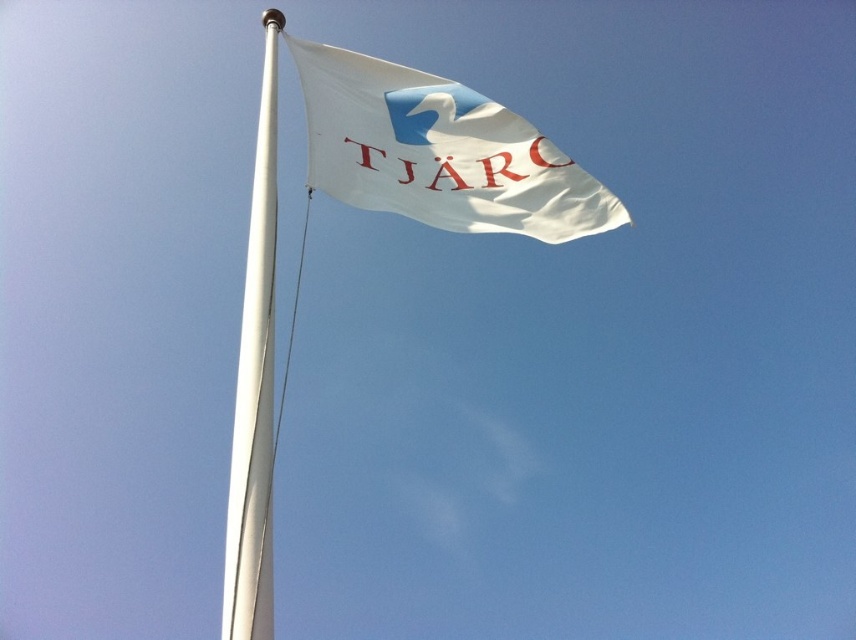
Is white fabric flag at upper center smaller than white metallic pole at upper left?

Yes, white fabric flag at upper center is smaller than white metallic pole at upper left.

Image resolution: width=856 pixels, height=640 pixels. Find the location of `white fabric flag at upper center`. white fabric flag at upper center is located at coordinates (438, 152).